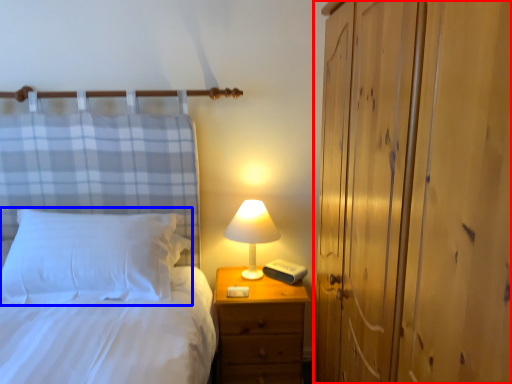
Question: Which object is closer to the camera taking this photo, dresser (highlighted by a red box) or pillow (highlighted by a blue box)?

Choices:
 (A) dresser
 (B) pillow

Answer: (A)